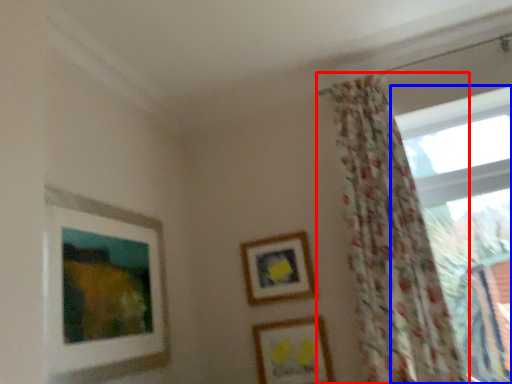
Question: Which of the following is the farthest to the observer, curtain (highlighted by a red box) or window (highlighted by a blue box)?

Choices:
 (A) curtain
 (B) window

Answer: (B)